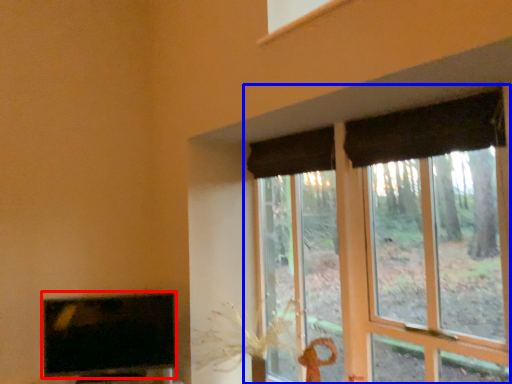
Question: Among these objects, which one is nearest to the camera, television (highlighted by a red box) or window (highlighted by a blue box)?

Choices:
 (A) television
 (B) window

Answer: (B)